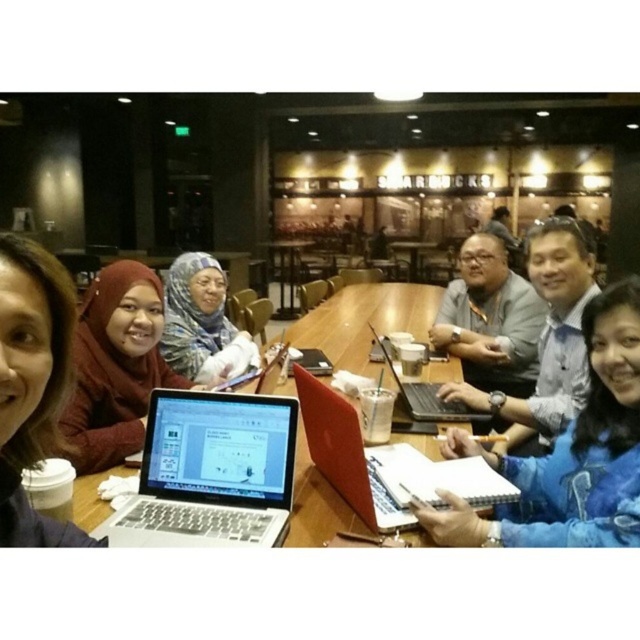
Question: Does matte blue hijab at center appear under black matte laptop at center?

Choices:
 (A) yes
 (B) no

Answer: (B)

Question: Which point appears farthest from the camera in this image?

Choices:
 (A) coord(170,529)
 (B) coord(348,314)

Answer: (B)

Question: Does blue denim jacket at lower right appear under red matte laptop at center?

Choices:
 (A) yes
 (B) no

Answer: (B)

Question: Does blue denim jacket at lower right lie in front of matte black laptop at lower left?

Choices:
 (A) yes
 (B) no

Answer: (B)

Question: Which object is closer to the camera taking this photo?

Choices:
 (A) black matte laptop at center
 (B) matte black hijab at center

Answer: (B)

Question: Which object appears farthest from the camera in this image?

Choices:
 (A) matte black laptop at lower left
 (B) wooden table at center
 (C) matte silver laptop at center

Answer: (B)